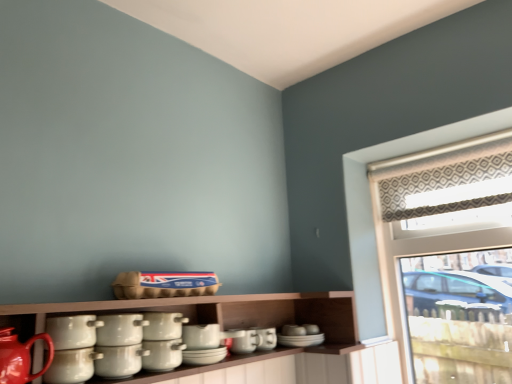
Question: Does white glossy pots at center, which is counted as the 5th tableware, starting from the back, appear on the left side of matte red teapot at lower left?

Choices:
 (A) no
 (B) yes

Answer: (A)

Question: Does white glossy pots at center, marked as the fifth tableware in a front-to-back arrangement, have a greater width compared to matte red teapot at lower left?

Choices:
 (A) no
 (B) yes

Answer: (B)

Question: Is white glossy pots at center, marked as the fifth tableware in a front-to-back arrangement, shorter than matte red teapot at lower left?

Choices:
 (A) no
 (B) yes

Answer: (B)

Question: Does white glossy pots at center, marked as the fifth tableware in a front-to-back arrangement, lie in front of matte red teapot at lower left?

Choices:
 (A) yes
 (B) no

Answer: (B)

Question: Is white glossy pots at center, marked as the fifth tableware in a front-to-back arrangement, further to the viewer compared to matte red teapot at lower left?

Choices:
 (A) no
 (B) yes

Answer: (B)

Question: Considering the relative positions of matte ceramic cup at center, which is the 9th tableware from front to back, and white glossy pots at center, marked as the fifth tableware in a front-to-back arrangement, in the image provided, is matte ceramic cup at center, which is the 9th tableware from front to back, to the left or to the right of white glossy pots at center, marked as the fifth tableware in a front-to-back arrangement,?

Choices:
 (A) left
 (B) right

Answer: (B)

Question: From a real-world perspective, is matte ceramic cup at center, the first tableware from the back, above or below white glossy pots at center, which is counted as the 5th tableware, starting from the back?

Choices:
 (A) above
 (B) below

Answer: (B)

Question: Is matte ceramic cup at center, the first tableware from the back, in front of or behind white glossy pots at center, marked as the fifth tableware in a front-to-back arrangement, in the image?

Choices:
 (A) behind
 (B) front

Answer: (A)

Question: Considering the positions of matte ceramic cup at center, which is the 9th tableware from front to back, and white glossy pots at center, which is counted as the 5th tableware, starting from the back, in the image, is matte ceramic cup at center, which is the 9th tableware from front to back, bigger or smaller than white glossy pots at center, which is counted as the 5th tableware, starting from the back,?

Choices:
 (A) big
 (B) small

Answer: (B)

Question: From a real-world perspective, relative to white glossy pot at center, acting as the fourth tableware starting from the front, is matte ceramic cup at center, the first tableware from the back, vertically above or below?

Choices:
 (A) above
 (B) below

Answer: (B)

Question: Is matte ceramic cup at center, which is the 9th tableware from front to back, wider or thinner than white glossy pot at center, placed as the sixth tableware when sorted from back to front?

Choices:
 (A) thin
 (B) wide

Answer: (B)

Question: From the image's perspective, is matte ceramic cup at center, the first tableware from the back, located above or below white glossy pot at center, acting as the fourth tableware starting from the front?

Choices:
 (A) below
 (B) above

Answer: (A)

Question: In the image, is matte ceramic cup at center, which is the 9th tableware from front to back, on the left side or the right side of white glossy pot at center, acting as the fourth tableware starting from the front?

Choices:
 (A) right
 (B) left

Answer: (A)

Question: Would you say patterned fabric at upper right is inside or outside matte red teapot at lower left?

Choices:
 (A) outside
 (B) inside

Answer: (A)

Question: In terms of width, does patterned fabric at upper right look wider or thinner when compared to matte red teapot at lower left?

Choices:
 (A) wide
 (B) thin

Answer: (A)